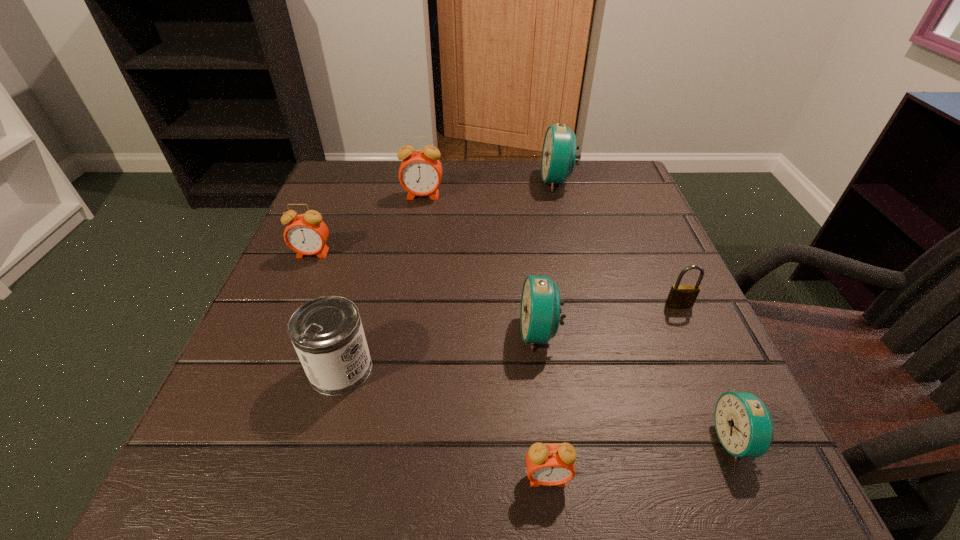
Find the location of a particular element. The height and width of the screenshot is (540, 960). alarm clock object that ranks as the second closest to the second nearest blue alarm clock is located at coordinates (744, 426).

Select which alarm clock appears as the second closest to the brass padlock. Please provide its 2D coordinates. Your answer should be formatted as a tuple, i.e. [(x, y)], where the tuple contains the x and y coordinates of a point satisfying the conditions above.

[(744, 426)]

The image size is (960, 540). What are the coordinates of `blue alarm clock that is the closest to the rightmost alarm clock` in the screenshot? It's located at (540, 310).

Locate which blue alarm clock is the closest to the second nearest blue alarm clock. Please provide its 2D coordinates. Your answer should be formatted as a tuple, i.e. [(x, y)], where the tuple contains the x and y coordinates of a point satisfying the conditions above.

[(744, 426)]

The width and height of the screenshot is (960, 540). I want to click on pink alarm clock that is the closest one to the rightmost alarm clock, so point(549,464).

Find the location of a particular element. The image size is (960, 540). the second closest pink alarm clock relative to the rightmost alarm clock is located at coordinates (420, 173).

Where is `free location that satisfies the following two spatial constraints: 1. on the front-facing side of the sixth object from left to right; 2. on the back side of the brass padlock`? The height and width of the screenshot is (540, 960). free location that satisfies the following two spatial constraints: 1. on the front-facing side of the sixth object from left to right; 2. on the back side of the brass padlock is located at coordinates (588, 305).